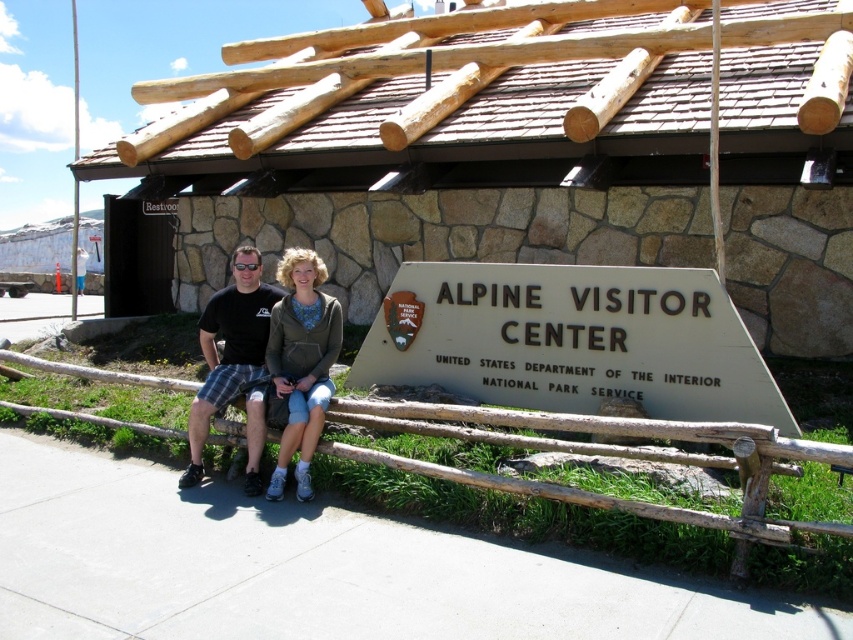
You are standing in front of the metallic gray sign at center and want to take a photo of it with your phone. Your phone can focus clearly on objects within 5 meters. Will the sign be in focus?

The metallic gray sign at center is 4.77 meters away from the viewer. Since your phone can focus clearly within 5 meters, the sign will be in focus.

You are a photographer standing in front of the metallic gray sign at center and the green textured hoodie at center. You want to capture a photo where both objects are clearly visible. Which object should you focus on first to ensure both are in frame?

The metallic gray sign at center is larger than the green textured hoodie at center, so focusing on the sign first will help ensure both objects are in frame.